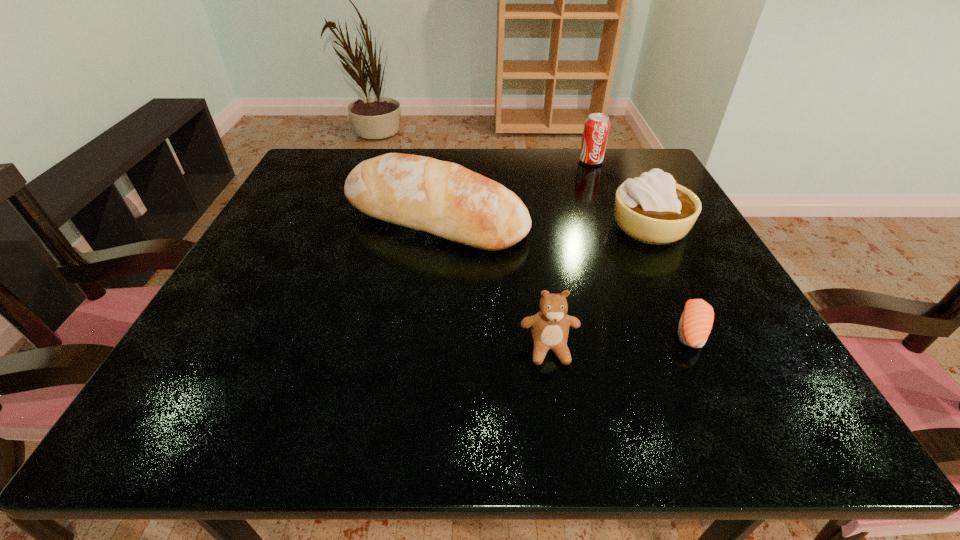
Find the location of a particular element. Image resolution: width=960 pixels, height=540 pixels. object that is the fourth closest to the farthest object is located at coordinates (550, 326).

Where is `object that stands as the second closest to the whipped cream`? object that stands as the second closest to the whipped cream is located at coordinates (445, 199).

The width and height of the screenshot is (960, 540). I want to click on free location that satisfies the following two spatial constraints: 1. on the logo side of the whipped cream; 2. on the right side of the farthest object, so click(616, 226).

The height and width of the screenshot is (540, 960). Find the location of `vacant region that satisfies the following two spatial constraints: 1. on the logo side of the sushi; 2. on the left side of the soda can`. vacant region that satisfies the following two spatial constraints: 1. on the logo side of the sushi; 2. on the left side of the soda can is located at coordinates (658, 330).

The height and width of the screenshot is (540, 960). Identify the location of vacant position in the image that satisfies the following two spatial constraints: 1. on the front side of the whipped cream; 2. on the right side of the bread. click(434, 226).

Locate an element on the screen. vacant area in the image that satisfies the following two spatial constraints: 1. on the logo side of the soda can; 2. on the left side of the sushi is located at coordinates (658, 330).

Locate an element on the screen. vacant position in the image that satisfies the following two spatial constraints: 1. on the logo side of the soda can; 2. on the right side of the sushi is located at coordinates (658, 330).

In order to click on free region that satisfies the following two spatial constraints: 1. on the logo side of the farthest object; 2. on the left side of the whipped cream in this screenshot , I will do `click(616, 226)`.